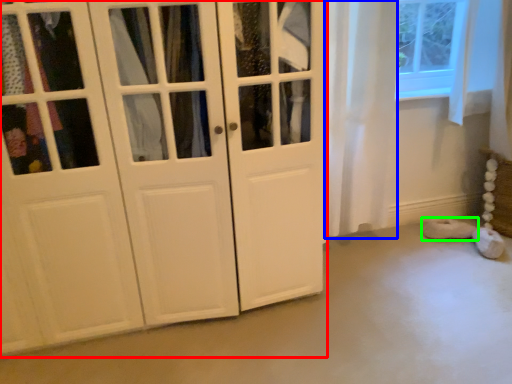
Question: Estimate the real-world distances between objects in this image. Which object is farther from cupboard (highlighted by a red box), curtain (highlighted by a blue box) or footwear (highlighted by a green box)?

Choices:
 (A) curtain
 (B) footwear

Answer: (B)